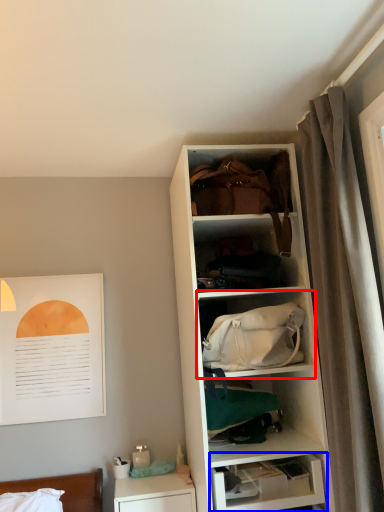
Question: Which object is further to the camera taking this photo, shelf (highlighted by a red box) or shelf (highlighted by a blue box)?

Choices:
 (A) shelf
 (B) shelf

Answer: (B)